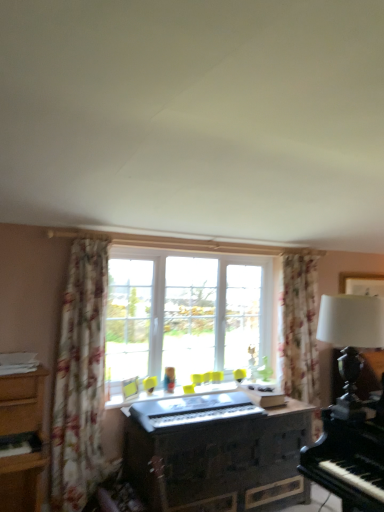
Question: From the image's perspective, relative to wooden dresser at center, is clear glass window at center above or below?

Choices:
 (A) above
 (B) below

Answer: (A)

Question: From their relative heights in the image, would you say clear glass window at center is taller or shorter than wooden dresser at center?

Choices:
 (A) short
 (B) tall

Answer: (B)

Question: Which object is positioned closest to the floral fabric curtain at left?

Choices:
 (A) white matte table lamp at right
 (B) metallic silver keyboard at center
 (C) clear glass window at center
 (D) wooden dresser at center

Answer: (B)

Question: Which object is positioned farthest from the floral fabric curtain at left?

Choices:
 (A) clear glass window at center
 (B) wooden dresser at center
 (C) white matte table lamp at right
 (D) metallic silver keyboard at center

Answer: (C)